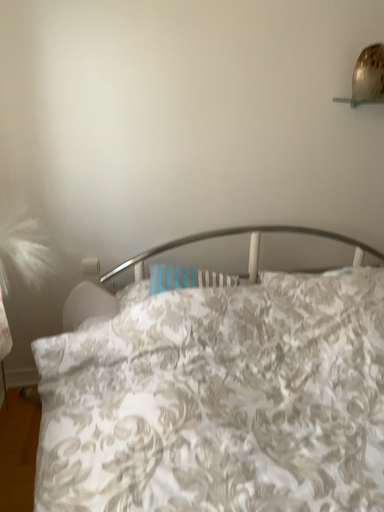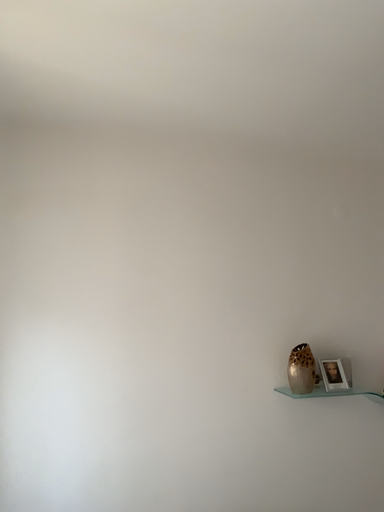
Question: How did the camera likely rotate when shooting the video?

Choices:
 (A) rotated upward
 (B) rotated downward

Answer: (A)